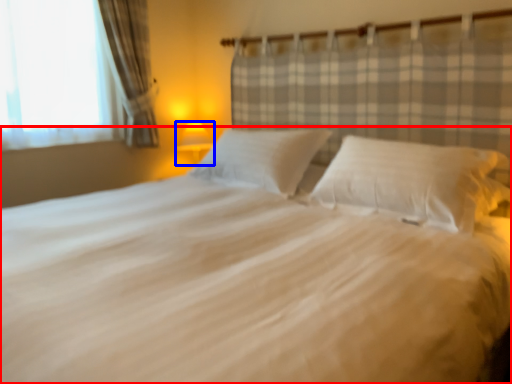
Question: Among these objects, which one is farthest to the camera, bed (highlighted by a red box) or lamp (highlighted by a blue box)?

Choices:
 (A) bed
 (B) lamp

Answer: (B)